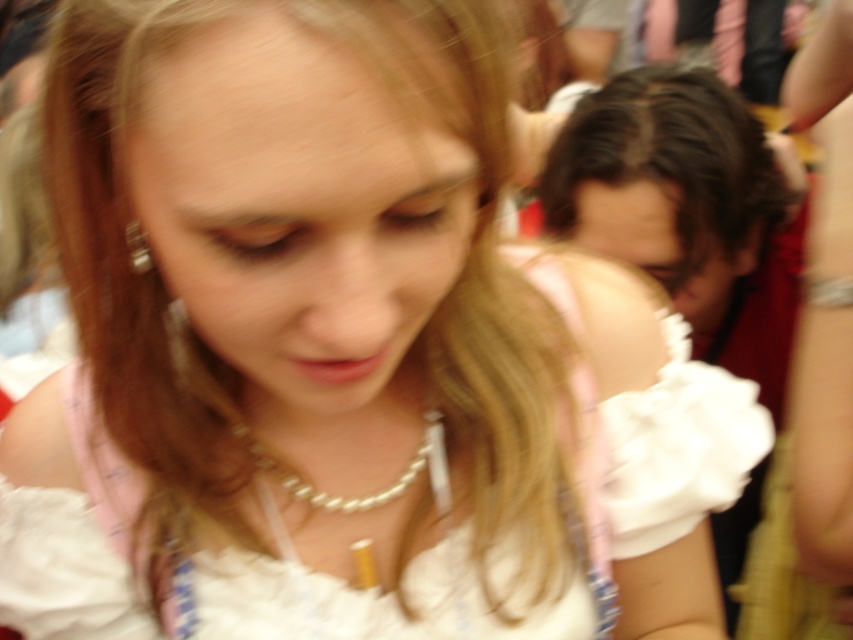
Can you confirm if dark brown hair at upper right is thinner than pearl necklace at center?

No, dark brown hair at upper right is not thinner than pearl necklace at center.

Is dark brown hair at upper right to the left of pearl necklace at center from the viewer's perspective?

Answer: No, dark brown hair at upper right is not to the left of pearl necklace at center.

Is point (648, 161) positioned before point (437, 508)?

No, it is not.

Image resolution: width=853 pixels, height=640 pixels. What are the coordinates of `dark brown hair at upper right` in the screenshot? It's located at (671, 157).